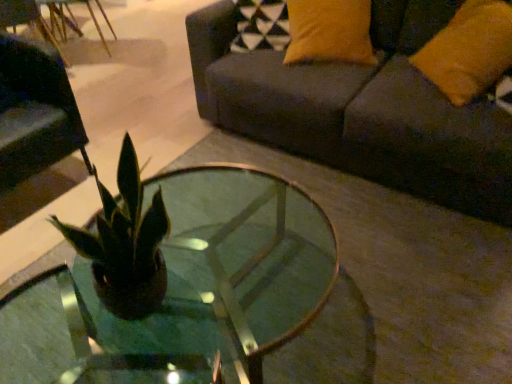
Question: Does matte black swivel chair at left have a smaller size compared to dark gray fabric couch at upper right?

Choices:
 (A) yes
 (B) no

Answer: (A)

Question: Are matte black swivel chair at left and dark gray fabric couch at upper right located far from each other?

Choices:
 (A) yes
 (B) no

Answer: (A)

Question: Would you say matte black swivel chair at left contains dark gray fabric couch at upper right?

Choices:
 (A) no
 (B) yes

Answer: (A)

Question: From the image's perspective, is matte black swivel chair at left located above dark gray fabric couch at upper right?

Choices:
 (A) yes
 (B) no

Answer: (B)

Question: Does matte black swivel chair at left come behind dark gray fabric couch at upper right?

Choices:
 (A) no
 (B) yes

Answer: (B)

Question: From a real-world perspective, is matte black swivel chair at left physically below dark gray fabric couch at upper right?

Choices:
 (A) no
 (B) yes

Answer: (B)

Question: Is orange fabric pillow at upper right oriented towards dark gray fabric couch at upper right?

Choices:
 (A) yes
 (B) no

Answer: (A)

Question: Would you say orange fabric pillow at upper right contains dark gray fabric couch at upper right?

Choices:
 (A) yes
 (B) no

Answer: (B)

Question: Is there a large distance between orange fabric pillow at upper right and dark gray fabric couch at upper right?

Choices:
 (A) no
 (B) yes

Answer: (A)

Question: Considering the relative sizes of orange fabric pillow at upper right and dark gray fabric couch at upper right in the image provided, is orange fabric pillow at upper right thinner than dark gray fabric couch at upper right?

Choices:
 (A) no
 (B) yes

Answer: (B)

Question: Considering the relative sizes of orange fabric pillow at upper right and dark gray fabric couch at upper right in the image provided, is orange fabric pillow at upper right bigger than dark gray fabric couch at upper right?

Choices:
 (A) yes
 (B) no

Answer: (B)

Question: From a real-world perspective, is orange fabric pillow at upper right located beneath dark gray fabric couch at upper right?

Choices:
 (A) yes
 (B) no

Answer: (B)

Question: Does dark gray fabric couch at upper right come in front of orange fabric pillow at upper right?

Choices:
 (A) yes
 (B) no

Answer: (A)